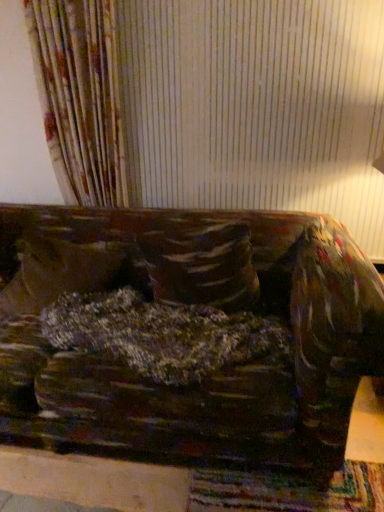
The width and height of the screenshot is (384, 512). What do you see at coordinates (189, 303) in the screenshot? I see `velvet-like brown couch at center` at bounding box center [189, 303].

Where is `velvety brown pillow at center, which is counted as the first pillow, starting from the right`? velvety brown pillow at center, which is counted as the first pillow, starting from the right is located at coordinates (201, 264).

What are the coordinates of `velvet-like brown couch at center` in the screenshot? It's located at (189, 303).

Does velvety brown pillow at center, marked as the second pillow in a left-to-right arrangement, lie behind velvet-like brown couch at center?

Yes, the depth of velvety brown pillow at center, marked as the second pillow in a left-to-right arrangement, is greater than that of velvet-like brown couch at center.

Can you confirm if velvety brown pillow at center, marked as the second pillow in a left-to-right arrangement, is wider than velvet-like brown couch at center?

No, velvety brown pillow at center, marked as the second pillow in a left-to-right arrangement, is not wider than velvet-like brown couch at center.

Is velvety brown pillow at center, marked as the second pillow in a left-to-right arrangement, aimed at velvet-like brown couch at center?

No, velvety brown pillow at center, marked as the second pillow in a left-to-right arrangement, is not facing towards velvet-like brown couch at center.

From the image's perspective, relative to velvet-like brown couch at center, is velvety brown pillow at center, which is counted as the first pillow, starting from the right, above or below?

velvety brown pillow at center, which is counted as the first pillow, starting from the right, is above velvet-like brown couch at center.

Looking at this image, is velvety brown pillow at center, which is counted as the first pillow, starting from the right, oriented away from velvety brown pillow at center, placed as the first pillow when sorted from left to right?

No.

From a real-world perspective, between velvety brown pillow at center, which is counted as the first pillow, starting from the right, and velvety brown pillow at center, placed as the first pillow when sorted from left to right, who is vertically higher?

From a 3D spatial view, velvety brown pillow at center, which is counted as the first pillow, starting from the right, is above.

Does velvety brown pillow at center, marked as the second pillow in a left-to-right arrangement, come in front of velvety brown pillow at center, the 2th pillow when ordered from right to left?

Yes.

Is velvety brown pillow at center, placed as the first pillow when sorted from left to right, in contact with velvet-like brown couch at center?

No, velvety brown pillow at center, placed as the first pillow when sorted from left to right, is not beside velvet-like brown couch at center.

Which of these two, velvety brown pillow at center, placed as the first pillow when sorted from left to right, or velvet-like brown couch at center, is wider?

With larger width is velvet-like brown couch at center.

From a real-world perspective, is velvety brown pillow at center, placed as the first pillow when sorted from left to right, physically located above or below velvet-like brown couch at center?

From a real-world perspective, velvety brown pillow at center, placed as the first pillow when sorted from left to right, is physically above velvet-like brown couch at center.

Which of these two, velvety brown pillow at center, placed as the first pillow when sorted from left to right, or velvet-like brown couch at center, is bigger?

velvet-like brown couch at center.

Considering the relative sizes of velvety brown pillow at center, placed as the first pillow when sorted from left to right, and velvety brown pillow at center, marked as the second pillow in a left-to-right arrangement, in the image provided, is velvety brown pillow at center, placed as the first pillow when sorted from left to right, thinner than velvety brown pillow at center, marked as the second pillow in a left-to-right arrangement,?

Incorrect, the width of velvety brown pillow at center, placed as the first pillow when sorted from left to right, is not less than that of velvety brown pillow at center, marked as the second pillow in a left-to-right arrangement.

Is velvety brown pillow at center, placed as the first pillow when sorted from left to right, positioned with its back to velvety brown pillow at center, which is counted as the first pillow, starting from the right?

No, velvety brown pillow at center, placed as the first pillow when sorted from left to right, is not facing the opposite direction of velvety brown pillow at center, which is counted as the first pillow, starting from the right.

Which of these two, velvety brown pillow at center, the 2th pillow when ordered from right to left, or velvety brown pillow at center, which is counted as the first pillow, starting from the right, is bigger?

Bigger between the two is velvety brown pillow at center, which is counted as the first pillow, starting from the right.

Is velvety brown pillow at center, the 2th pillow when ordered from right to left, taller or shorter than velvety brown pillow at center, which is counted as the first pillow, starting from the right?

Clearly, velvety brown pillow at center, the 2th pillow when ordered from right to left, is shorter compared to velvety brown pillow at center, which is counted as the first pillow, starting from the right.

Between velvet-like brown couch at center and velvety brown pillow at center, which is counted as the first pillow, starting from the right, which one has larger width?

velvet-like brown couch at center is wider.

From a real-world perspective, is velvet-like brown couch at center physically located above or below velvety brown pillow at center, which is counted as the first pillow, starting from the right?

Clearly, from a real-world perspective, velvet-like brown couch at center is below velvety brown pillow at center, which is counted as the first pillow, starting from the right.

Considering the sizes of objects velvet-like brown couch at center and velvety brown pillow at center, marked as the second pillow in a left-to-right arrangement, in the image provided, who is taller, velvet-like brown couch at center or velvety brown pillow at center, marked as the second pillow in a left-to-right arrangement,?

velvety brown pillow at center, marked as the second pillow in a left-to-right arrangement, is taller.

Is velvet-like brown couch at center positioned with its back to velvety brown pillow at center, the 2th pillow when ordered from right to left?

velvet-like brown couch at center does not have its back to velvety brown pillow at center, the 2th pillow when ordered from right to left.

In terms of height, does velvet-like brown couch at center look taller or shorter compared to velvety brown pillow at center, the 2th pillow when ordered from right to left?

In the image, velvet-like brown couch at center appears to be shorter than velvety brown pillow at center, the 2th pillow when ordered from right to left.

Is velvet-like brown couch at center not close to velvety brown pillow at center, placed as the first pillow when sorted from left to right?

That's not correct — velvet-like brown couch at center is a little close to velvety brown pillow at center, placed as the first pillow when sorted from left to right.

Is velvet-like brown couch at center smaller than velvety brown pillow at center, placed as the first pillow when sorted from left to right?

No.

In the image, there is a velvety brown pillow at center, marked as the second pillow in a left-to-right arrangement. Where is `studio couch below it (from a real-world perspective)`? The image size is (384, 512). studio couch below it (from a real-world perspective) is located at coordinates (189, 303).

In order to click on pillow on the right of velvety brown pillow at center, the 2th pillow when ordered from right to left in this screenshot , I will do `click(201, 264)`.

Considering their positions, is velvety brown pillow at center, which is counted as the first pillow, starting from the right, positioned further to velvet-like brown couch at center than velvety brown pillow at center, the 2th pillow when ordered from right to left?

velvety brown pillow at center, the 2th pillow when ordered from right to left.

Considering their positions, is velvet-like brown couch at center positioned closer to velvety brown pillow at center, the 2th pillow when ordered from right to left, than velvety brown pillow at center, which is counted as the first pillow, starting from the right?

velvet-like brown couch at center is closer to velvety brown pillow at center, the 2th pillow when ordered from right to left.

Looking at the image, which one is located further to velvety brown pillow at center, marked as the second pillow in a left-to-right arrangement, velvet-like brown couch at center or velvety brown pillow at center, the 2th pillow when ordered from right to left?

velvety brown pillow at center, the 2th pillow when ordered from right to left, is positioned further to the anchor velvety brown pillow at center, marked as the second pillow in a left-to-right arrangement.

Estimate the real-world distances between objects in this image. Which object is further from velvet-like brown couch at center, velvety brown pillow at center, placed as the first pillow when sorted from left to right, or velvety brown pillow at center, marked as the second pillow in a left-to-right arrangement?

velvety brown pillow at center, placed as the first pillow when sorted from left to right, is further to velvet-like brown couch at center.

Looking at the image, which one is located closer to velvety brown pillow at center, the 2th pillow when ordered from right to left, velvety brown pillow at center, which is counted as the first pillow, starting from the right, or velvet-like brown couch at center?

Among the two, velvet-like brown couch at center is located nearer to velvety brown pillow at center, the 2th pillow when ordered from right to left.

Which object lies nearer to the anchor point velvety brown pillow at center, marked as the second pillow in a left-to-right arrangement, velvety brown pillow at center, placed as the first pillow when sorted from left to right, or velvet-like brown couch at center?

velvet-like brown couch at center lies closer to velvety brown pillow at center, marked as the second pillow in a left-to-right arrangement, than the other object.

At what (x,y) coordinates should I click in order to perform the action: click on pillow between velvety brown pillow at center, placed as the first pillow when sorted from left to right, and velvet-like brown couch at center. Please return your answer as a coordinate pair (x, y). This screenshot has width=384, height=512. Looking at the image, I should click on (201, 264).